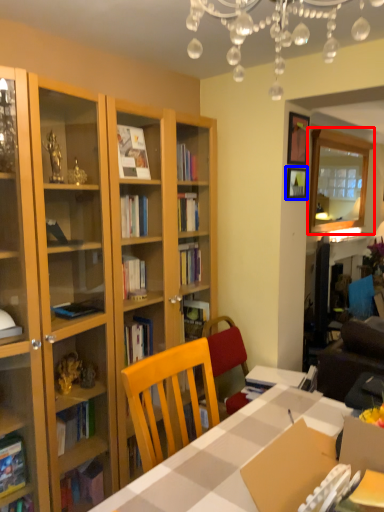
Question: Which object appears farthest to the camera in this image, glass door (highlighted by a red box) or picture frame (highlighted by a blue box)?

Choices:
 (A) glass door
 (B) picture frame

Answer: (A)